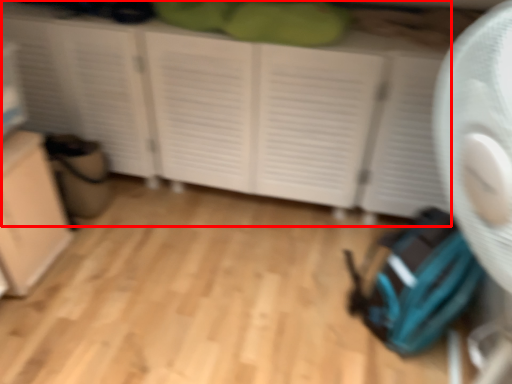
Question: From the image's perspective, what is the correct spatial positioning of cupboard (annotated by the red box) in reference to cabinetry?

Choices:
 (A) below
 (B) above

Answer: (B)